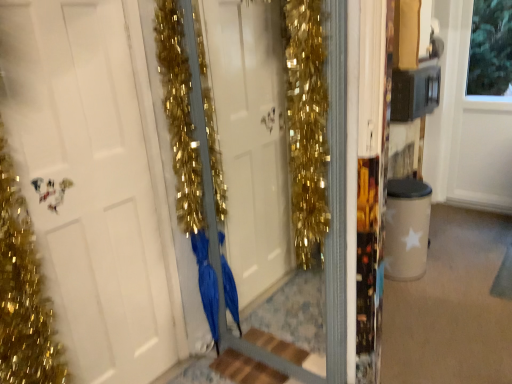
Question: From the image's perspective, is blue satin dress at center above white matte door at center?

Choices:
 (A) yes
 (B) no

Answer: (B)

Question: From a real-world perspective, is blue satin dress at center on white matte door at center?

Choices:
 (A) yes
 (B) no

Answer: (B)

Question: Can you confirm if blue satin dress at center is positioned to the right of white matte door at center?

Choices:
 (A) no
 (B) yes

Answer: (B)

Question: Is blue satin dress at center closer to the viewer compared to white matte door at center?

Choices:
 (A) no
 (B) yes

Answer: (A)

Question: Is white matte door at center completely or partially inside blue satin dress at center?

Choices:
 (A) no
 (B) yes

Answer: (A)

Question: From a real-world perspective, is blue satin dress at center located beneath white matte door at center?

Choices:
 (A) no
 (B) yes

Answer: (B)

Question: Is wooden at center with white matte door at center?

Choices:
 (A) no
 (B) yes

Answer: (A)

Question: Is wooden at center wider than white matte door at center?

Choices:
 (A) yes
 (B) no

Answer: (A)

Question: Is wooden at center not inside white matte door at center?

Choices:
 (A) no
 (B) yes

Answer: (B)

Question: Considering the relative sizes of wooden at center and white matte door at center in the image provided, is wooden at center thinner than white matte door at center?

Choices:
 (A) yes
 (B) no

Answer: (B)

Question: Would you say white matte door at center is part of wooden at center's contents?

Choices:
 (A) no
 (B) yes

Answer: (A)

Question: Is wooden at center looking in the opposite direction of white matte door at center?

Choices:
 (A) no
 (B) yes

Answer: (A)

Question: Is white matte door at center outside of wooden at center?

Choices:
 (A) no
 (B) yes

Answer: (B)